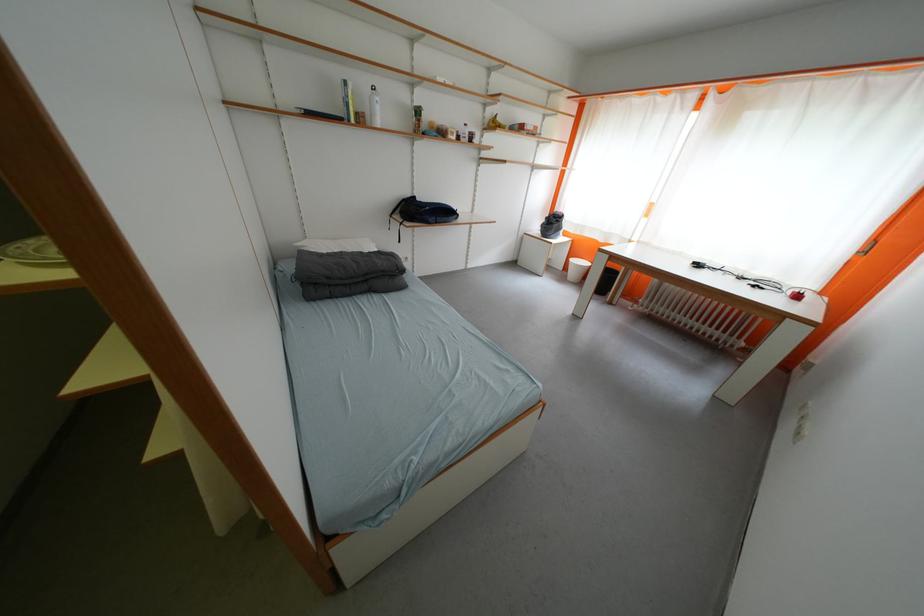
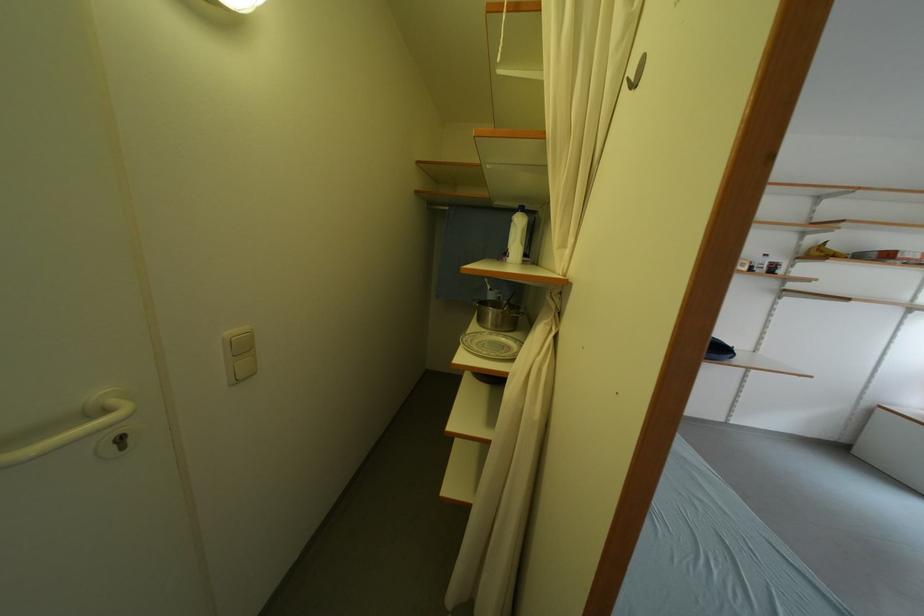
Locate, in the second image, the point that corresponds to pixel 43 246 in the first image.

(476, 339)